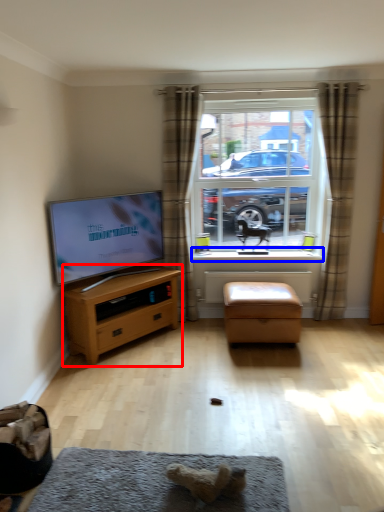
Question: Which object appears closest to the camera in this image, chest of drawers (highlighted by a red box) or window sill (highlighted by a blue box)?

Choices:
 (A) chest of drawers
 (B) window sill

Answer: (A)